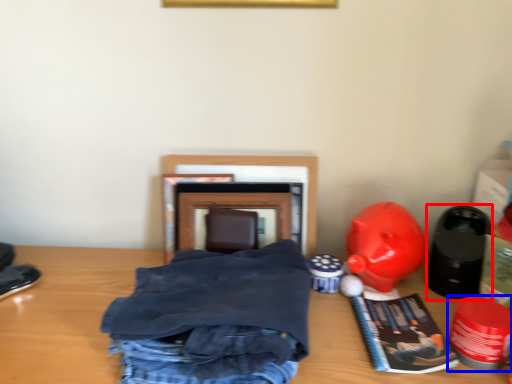
Question: Which object appears closest to the camera in this image, toy (highlighted by a red box) or toy (highlighted by a blue box)?

Choices:
 (A) toy
 (B) toy

Answer: (B)